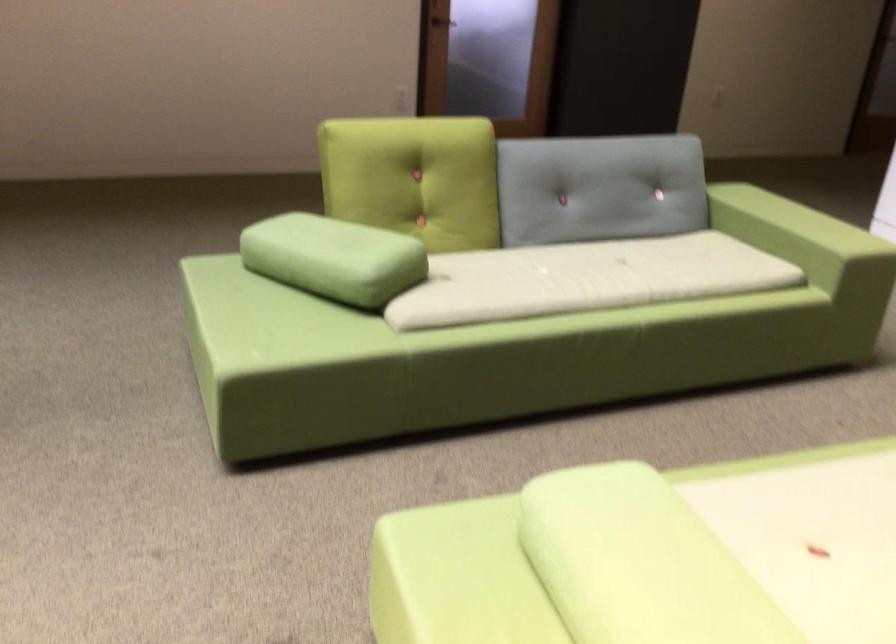
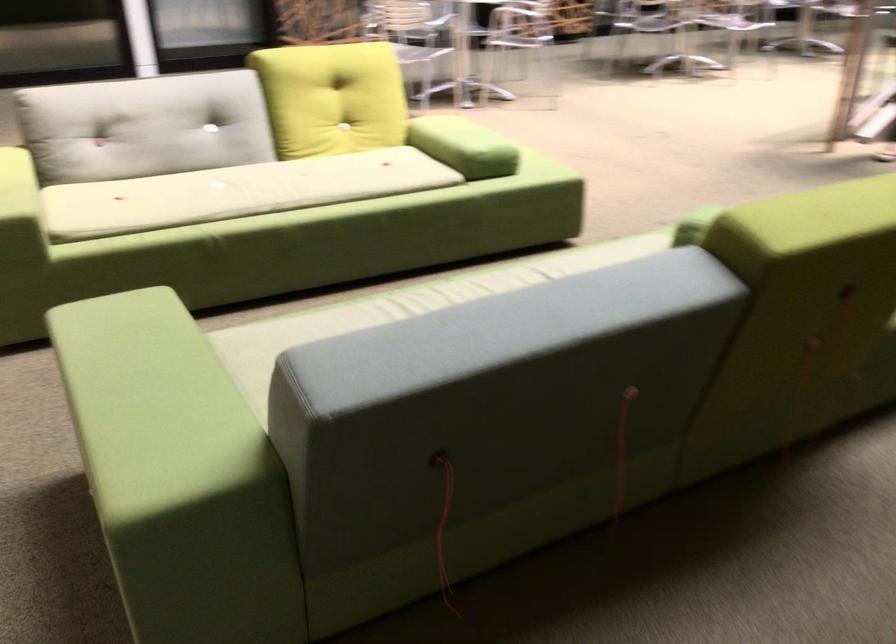
Question: I am providing you with two images of the same scene from different viewpoints. Please identify which objects are invisible in image2.

Choices:
 (A) sofa sitting surface
 (B) light green cushion
 (C) blue spatula handle
 (D) sofa armrest

Answer: (B)